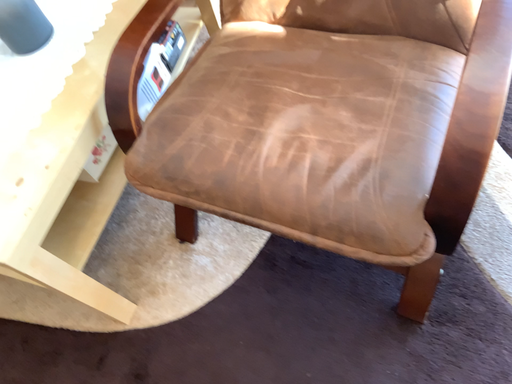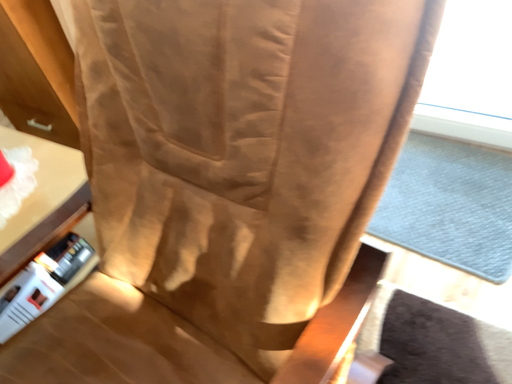
Question: How did the camera likely rotate when shooting the video?

Choices:
 (A) rotated downward
 (B) rotated upward

Answer: (B)